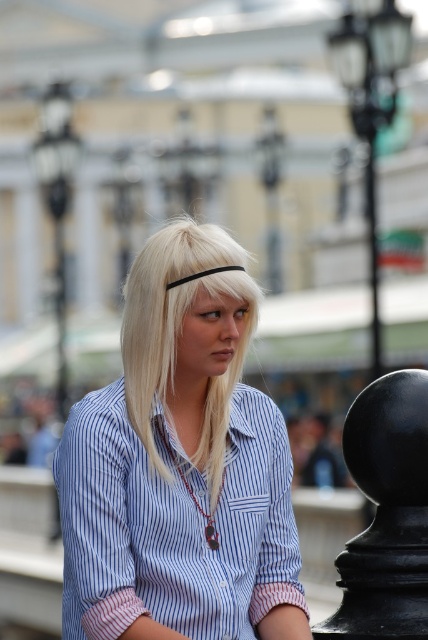
Question: Which object is farther from the camera taking this photo?

Choices:
 (A) blue striped shirt at center
 (B) blonde hair at center

Answer: (B)

Question: Does blue striped shirt at center appear on the left side of blonde hair at center?

Choices:
 (A) yes
 (B) no

Answer: (B)

Question: From the image, what is the correct spatial relationship of blue striped shirt at center in relation to blonde hair at center?

Choices:
 (A) above
 (B) below

Answer: (B)

Question: Is blue striped shirt at center bigger than blonde hair at center?

Choices:
 (A) yes
 (B) no

Answer: (A)

Question: Which point appears farthest from the camera in this image?

Choices:
 (A) (121, 532)
 (B) (183, 316)

Answer: (B)